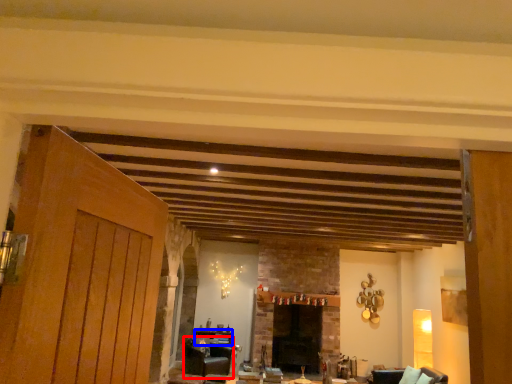
Question: Among these objects, which one is farthest to the camera, furniture (highlighted by a red box) or table (highlighted by a blue box)?

Choices:
 (A) furniture
 (B) table

Answer: (B)